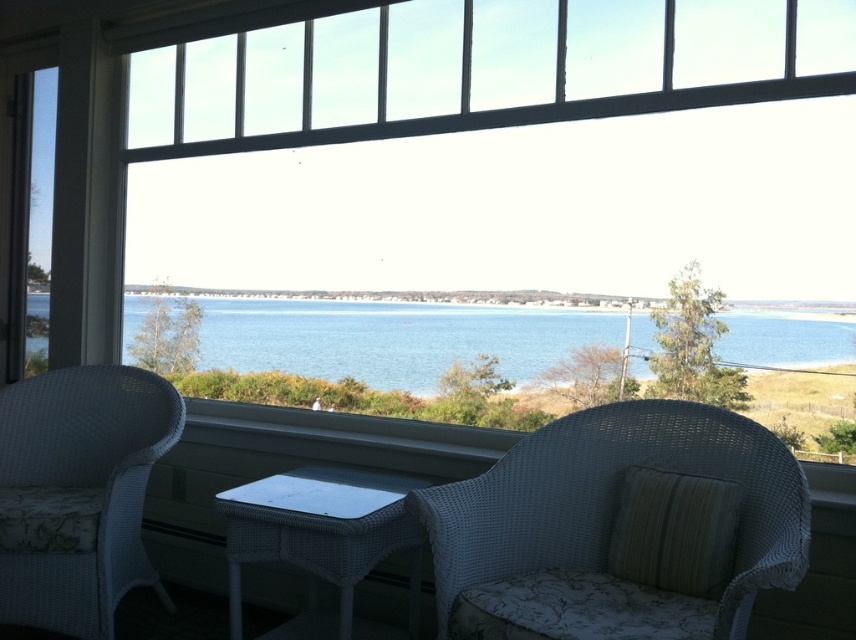
You are planning to hang a large painting that is 2 meters wide on the wall in this sunroom. The transparent glass window at center and the blue water at center are both in your way. Which object do you need to move to make space for the painting?

The transparent glass window at center has a larger width than the blue water at center, so you need to move the transparent glass window at center to make space for the painting since it occupies more of the wall.

You are standing in the sunroom and want to look outside through the transparent glass window at center. According to the coordinates provided, where should you look to see the window?

The transparent glass window at center is located at the coordinates point (199, 141), so you should look there to see the window.